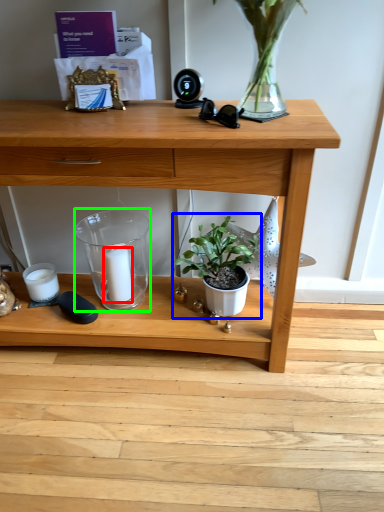
Question: Estimate the real-world distances between objects in this image. Which object is closer to candle (highlighted by a red box), houseplant (highlighted by a blue box) or glass vase (highlighted by a green box)?

Choices:
 (A) houseplant
 (B) glass vase

Answer: (B)